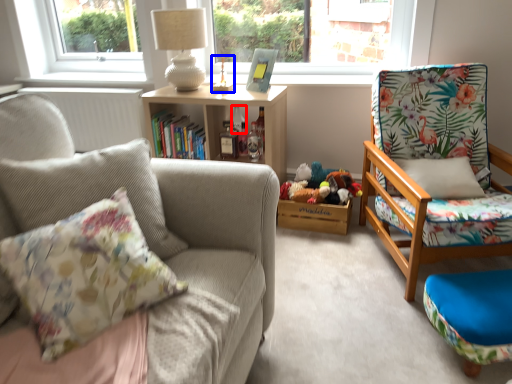
Question: Which object appears farthest to the camera in this image, bottle (highlighted by a red box) or toy (highlighted by a blue box)?

Choices:
 (A) bottle
 (B) toy

Answer: (A)